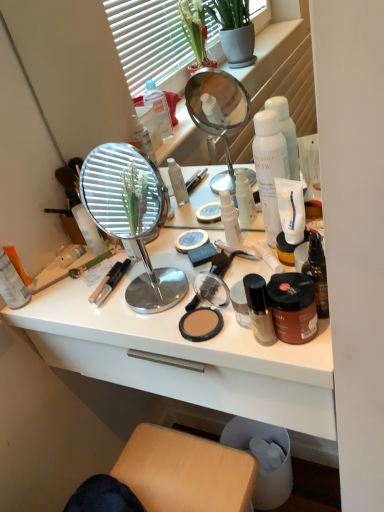
You are a GUI agent. You are given a task and a screenshot of the screen. Output one action in this format:
    pyautogui.click(x=<x>, y=<y>)
    Task: Click on the free space that is in between orange matte lotion at left, positioned as the first toiletry in left-to-right order, and shiny brown bottle at right, the 5th toiletry viewed from the left
    This screenshot has height=512, width=384.
    Given the screenshot: What is the action you would take?
    pyautogui.click(x=107, y=306)